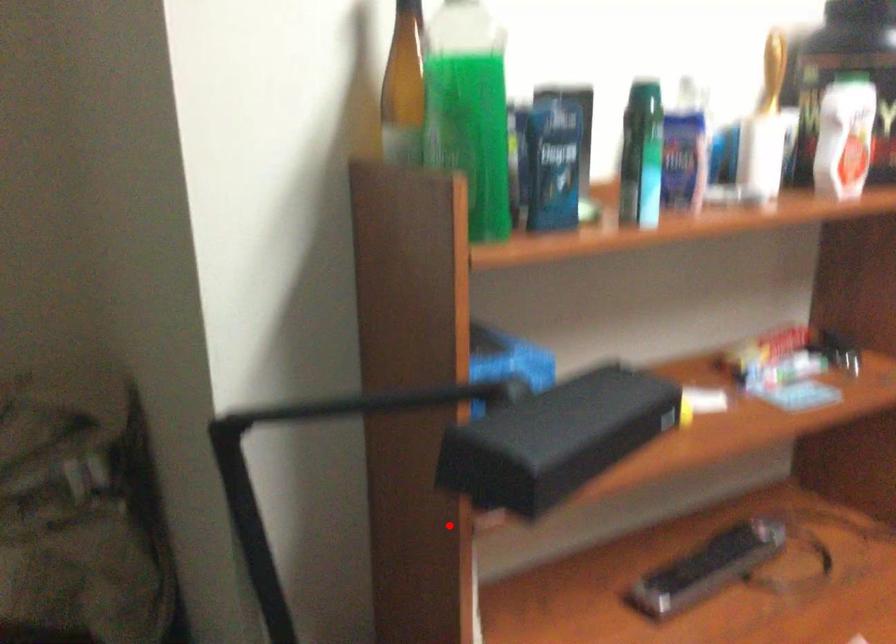
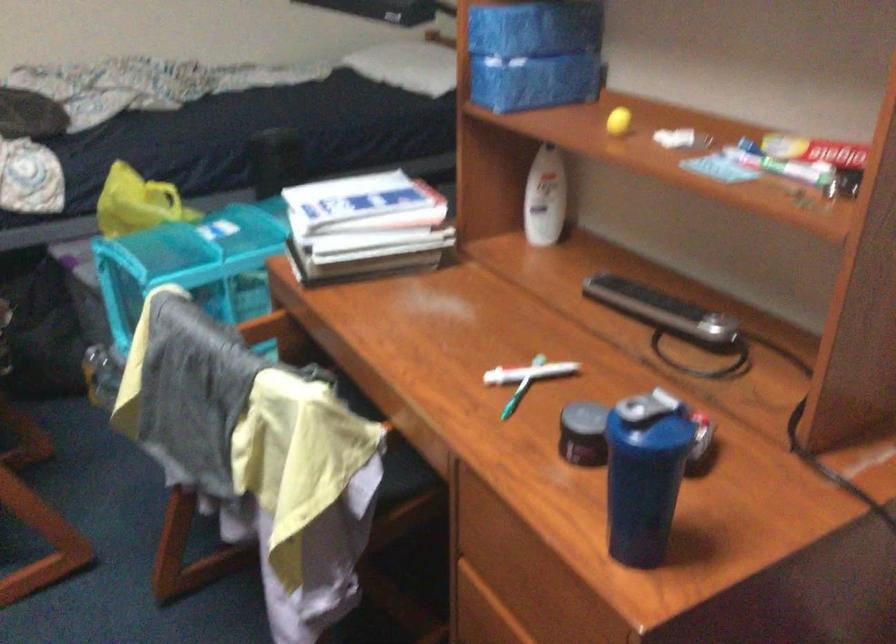
The point at the highlighted location is marked in the first image. Where is the corresponding point in the second image?

(541, 147)